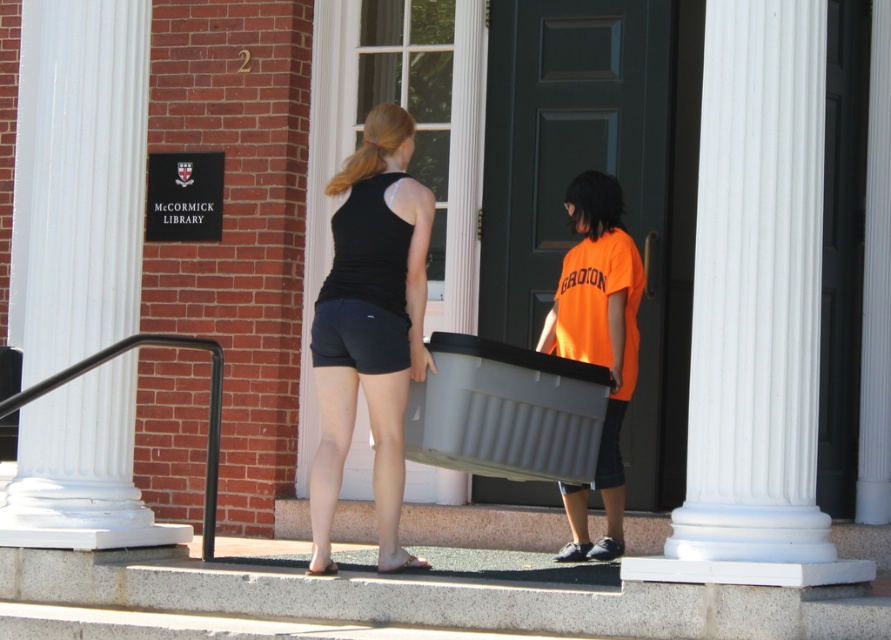
You are a photographer trying to capture a photo of the white smooth column at center and the black matte tank top at center. Which object should you focus on first if you want to ensure both are in sharp focus, considering their sizes?

The white smooth column at center is bigger than the black matte tank top at center, so you should focus on the white smooth column at center first to ensure both are in sharp focus.

You are a delivery person who needs to place a 1.5 meter long box between the white smooth column at center and the orange matte shirt at center. Is there enough space between them to fit the box?

Result: The distance between the white smooth column at center and the orange matte shirt at center is 1.43 meters. Since the box is 1.5 meters long, it is slightly longer than the available space. Therefore, the box cannot be placed between them without overlapping.